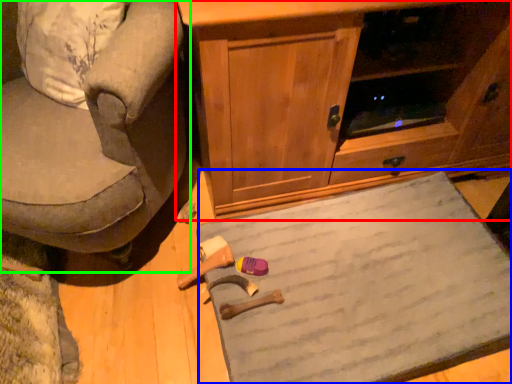
Question: Based on their relative distances, which object is nearer to cabinetry (highlighted by a red box)? Choose from doormat (highlighted by a blue box) and chair (highlighted by a green box).

Choices:
 (A) doormat
 (B) chair

Answer: (A)